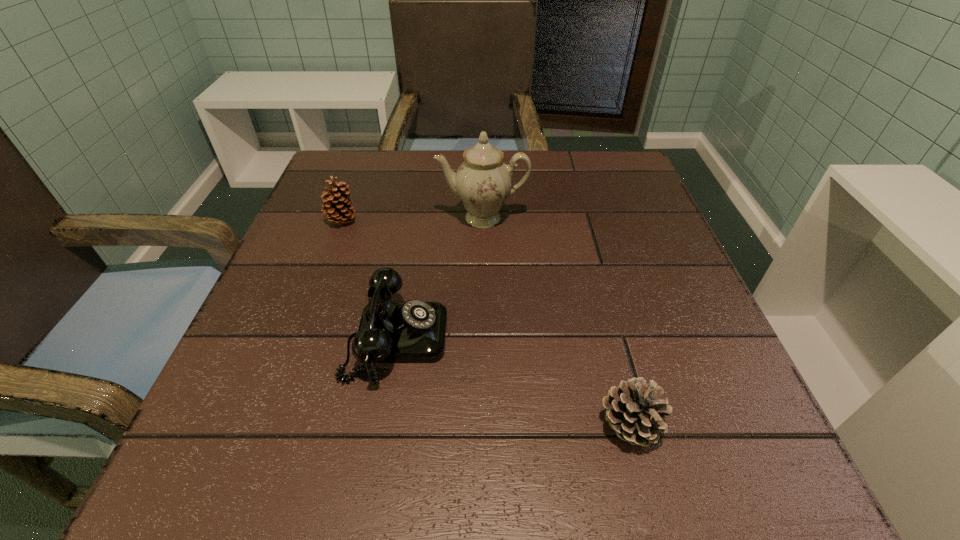
You are a GUI agent. You are given a task and a screenshot of the screen. Output one action in this format:
    pyautogui.click(x=<x>, y=<y>)
    Task: Click on the object that is positioned at the far edge
    The image size is (960, 540).
    Given the screenshot: What is the action you would take?
    pyautogui.click(x=483, y=181)

The width and height of the screenshot is (960, 540). Identify the location of object at the near edge. (634, 411).

Locate an element on the screen. This screenshot has width=960, height=540. object at the left edge is located at coordinates (339, 209).

You are a GUI agent. You are given a task and a screenshot of the screen. Output one action in this format:
    pyautogui.click(x=<x>, y=<y>)
    Task: Click on the object that is at the right edge
    
    Given the screenshot: What is the action you would take?
    pyautogui.click(x=634, y=411)

Where is `object that is positioned at the near right corner`? object that is positioned at the near right corner is located at coordinates (634, 411).

You are a GUI agent. You are given a task and a screenshot of the screen. Output one action in this format:
    pyautogui.click(x=<x>, y=<y>)
    Task: Click on the free space at the far edge of the desktop
    This screenshot has width=960, height=540.
    Given the screenshot: What is the action you would take?
    pyautogui.click(x=510, y=158)

In the image, there is a desktop. Identify the location of free space at the near edge. (320, 471).

Image resolution: width=960 pixels, height=540 pixels. I want to click on vacant area at the left edge, so click(305, 222).

In the image, there is a desktop. Identify the location of free space at the right edge. click(621, 208).

Where is `vacant space at the far left corner of the desktop`? This screenshot has height=540, width=960. vacant space at the far left corner of the desktop is located at coordinates (363, 176).